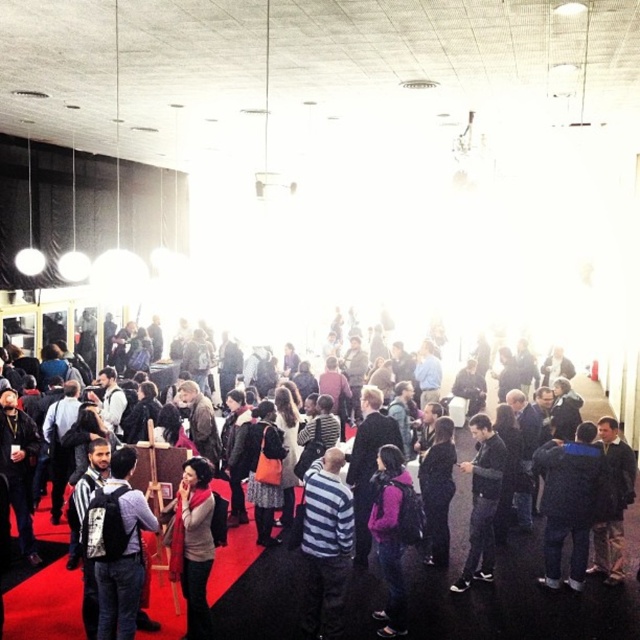
You are at an event and need to locate two people wearing the striped cotton shirt at center and the dark gray sweater at center. According to the scene, which one is positioned to the left?

The striped cotton shirt at center is to the left of the dark gray sweater at center, so the striped cotton shirt at center is positioned to the left.

You are standing at the entrance of the event hall and see the dark blue jacket at lower right and the dark gray sweater at center. Which clothing item is positioned higher from the ground?

The dark blue jacket at lower right is above the dark gray sweater at center, so it is positioned higher from the ground.